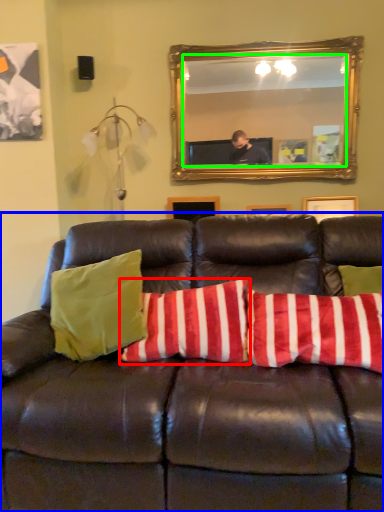
Question: Which object is the closest to the pillow (highlighted by a red box)? Choose among these: studio couch (highlighted by a blue box) or mirror (highlighted by a green box).

Choices:
 (A) studio couch
 (B) mirror

Answer: (A)